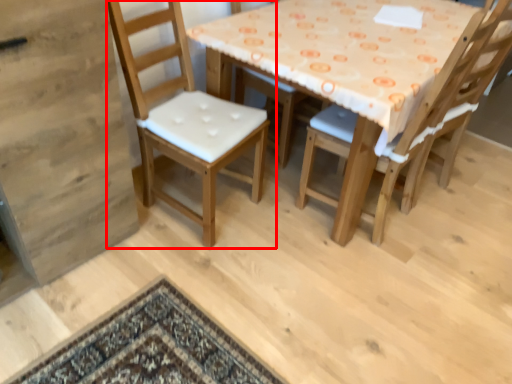
Question: From the image's perspective, where is chair (annotated by the red box) located in relation to chair in the image?

Choices:
 (A) above
 (B) below

Answer: (A)